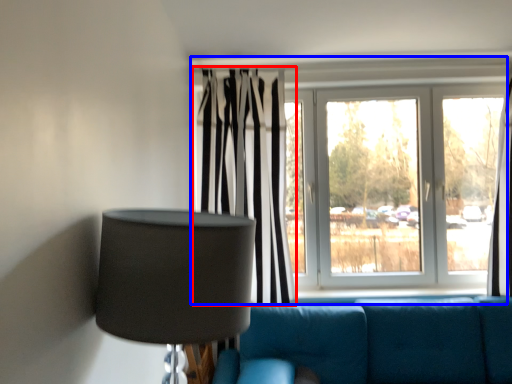
Question: Among these objects, which one is farthest to the camera, curtain (highlighted by a red box) or window (highlighted by a blue box)?

Choices:
 (A) curtain
 (B) window

Answer: (B)